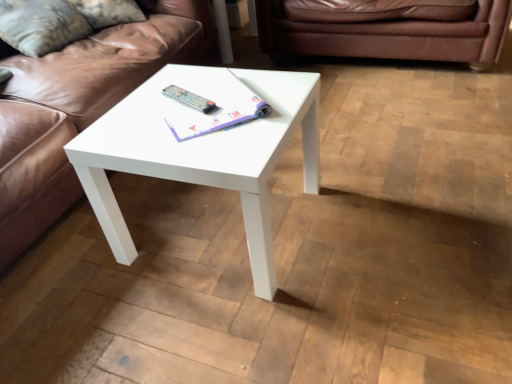
This screenshot has width=512, height=384. I want to click on free space to the right of silver metallic remote at center, so click(229, 99).